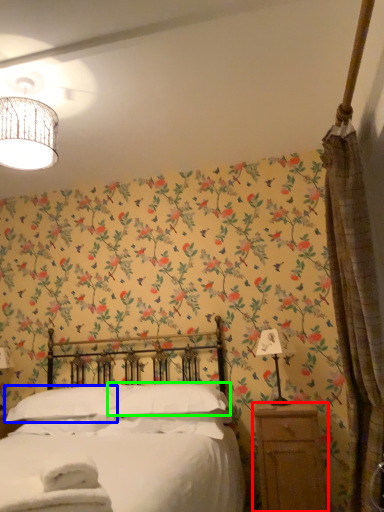
Question: Which is nearer to the nightstand (highlighted by a red box)? pillow (highlighted by a blue box) or pillow (highlighted by a green box).

Choices:
 (A) pillow
 (B) pillow

Answer: (B)